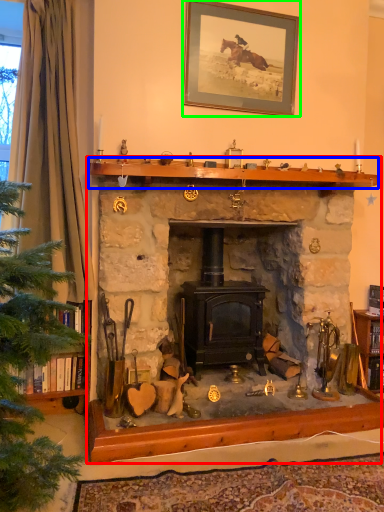
Question: Estimate the real-world distances between objects in this image. Which object is closer to fireplace (highlighted by a red box), mantle (highlighted by a blue box) or picture frame (highlighted by a green box)?

Choices:
 (A) mantle
 (B) picture frame

Answer: (A)